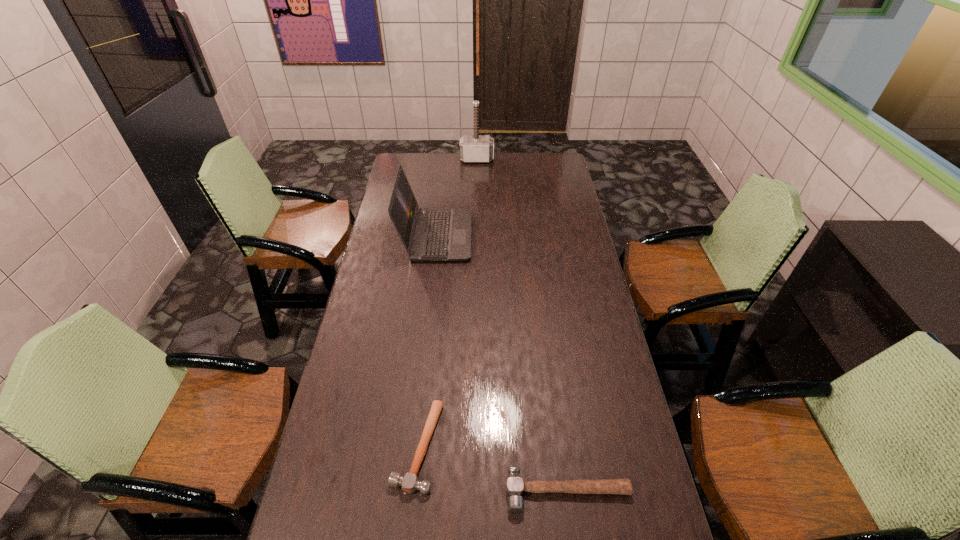
Identify the location of vacant area that lies between the tallest object and the laptop_computer. (457, 198).

This screenshot has width=960, height=540. I want to click on free point between the leftmost hammer and the second tallest object, so point(427,341).

Image resolution: width=960 pixels, height=540 pixels. What are the coordinates of `object that is the third closest one to the farthest hammer` in the screenshot? It's located at (515, 486).

The height and width of the screenshot is (540, 960). Identify the location of the second closest object relative to the third shortest object. (409, 483).

Find the location of a particular element. Image resolution: width=960 pixels, height=540 pixels. hammer that stands as the second closest to the second tallest object is located at coordinates (409, 483).

Select which hammer appears as the second closest to the third nearest object. Please provide its 2D coordinates. Your answer should be formatted as a tuple, i.e. [(x, y)], where the tuple contains the x and y coordinates of a point satisfying the conditions above.

[(409, 483)]

You are a GUI agent. You are given a task and a screenshot of the screen. Output one action in this format:
    pyautogui.click(x=<x>, y=<y>)
    Task: Click on the vacant space that satisfies the following two spatial constraints: 1. on the screen of the second tallest object; 2. on the back side of the leftmost hammer
    This screenshot has width=960, height=540.
    Given the screenshot: What is the action you would take?
    pyautogui.click(x=413, y=446)

You are a GUI agent. You are given a task and a screenshot of the screen. Output one action in this format:
    pyautogui.click(x=<x>, y=<y>)
    Task: Click on the vacant point that satisfies the following two spatial constraints: 1. for striking with the head of the tallest object; 2. on the screen of the laptop_computer
    
    Given the screenshot: What is the action you would take?
    pyautogui.click(x=476, y=236)

Where is `vacant space that satisfies the following two spatial constraints: 1. on the screen of the laptop_computer; 2. on the left side of the leftmost hammer`? vacant space that satisfies the following two spatial constraints: 1. on the screen of the laptop_computer; 2. on the left side of the leftmost hammer is located at coordinates (413, 446).